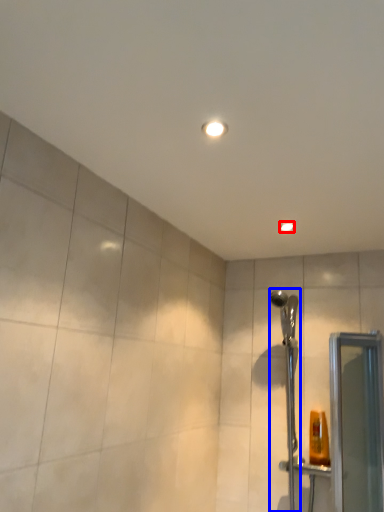
Question: Which object appears closest to the camera in this image, light fixture (highlighted by a red box) or shower (highlighted by a blue box)?

Choices:
 (A) light fixture
 (B) shower

Answer: (B)